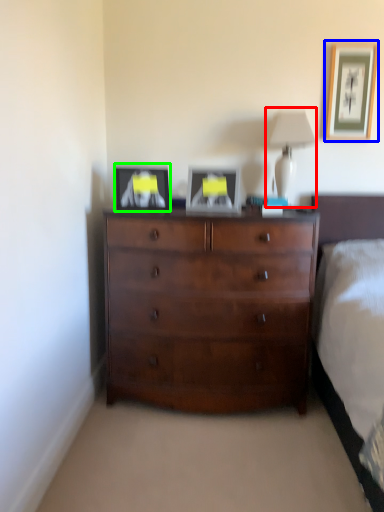
Question: Considering the real-world distances, which object is farthest from table lamp (highlighted by a red box)? picture frame (highlighted by a blue box) or picture frame (highlighted by a green box)?

Choices:
 (A) picture frame
 (B) picture frame

Answer: (B)